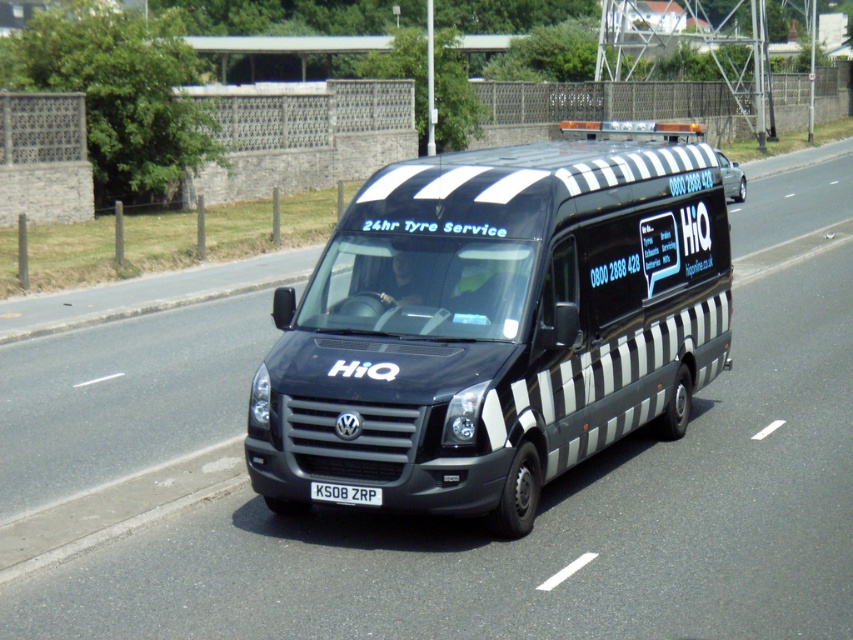
You are standing on the sidewalk next to the matte black van at center. You want to cross the road to reach the park on the other side. The road has a speed limit of 30 mph. Can you safely cross the road from here?

The matte black van at center is 7.04 meters away from you. Since the van is parked on the side of the road, you need to check for oncoming traffic. However, the distance alone doesn not determine safety. You should look both ways and ensure no vehicles are approaching before crossing.

You are a pedestrian standing on the sidewalk and see the matte black van at center and the black metallic license plate at center. Which object is closer to you?

The matte black van at center is closer to you because it is in front of the black metallic license plate at center.